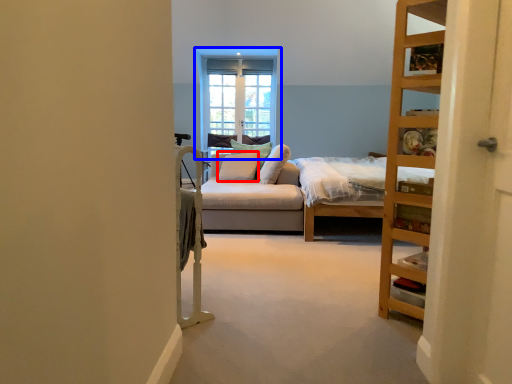
Question: Which object is closer to the camera taking this photo, pillow (highlighted by a red box) or window (highlighted by a blue box)?

Choices:
 (A) pillow
 (B) window

Answer: (A)